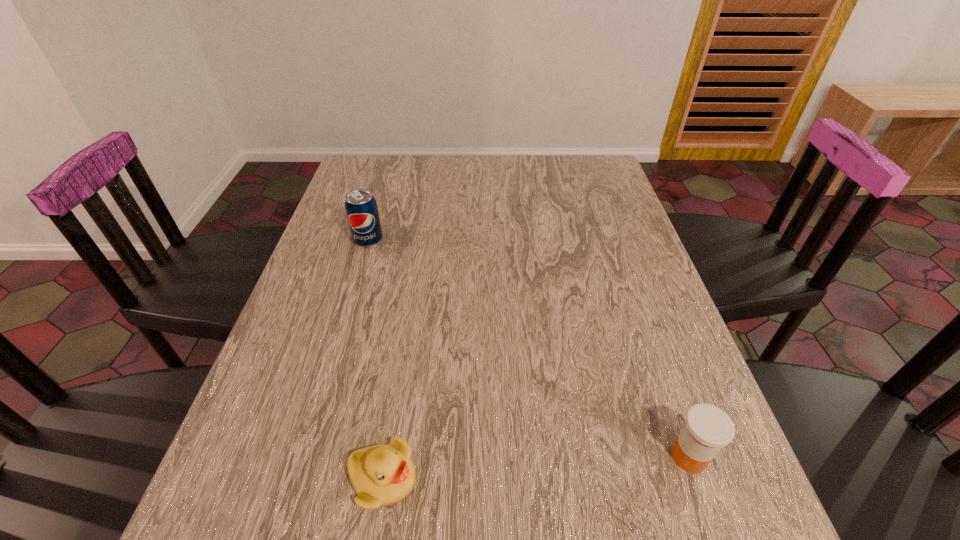
Locate an element on the screen. This screenshot has width=960, height=540. object that stands as the closest to the rightmost object is located at coordinates (384, 474).

Identify which object is the second nearest to the medicine. Please provide its 2D coordinates. Your answer should be formatted as a tuple, i.e. [(x, y)], where the tuple contains the x and y coordinates of a point satisfying the conditions above.

[(361, 208)]